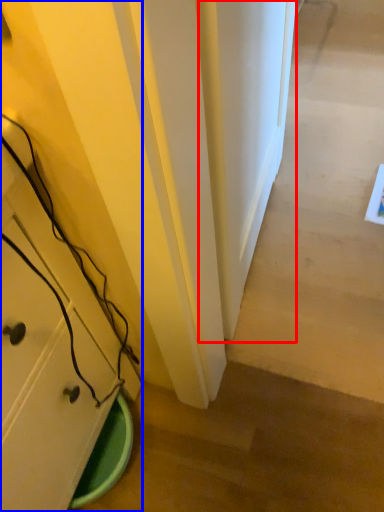
Question: Among these objects, which one is farthest to the camera, door (highlighted by a red box) or cabinetry (highlighted by a blue box)?

Choices:
 (A) door
 (B) cabinetry

Answer: (A)